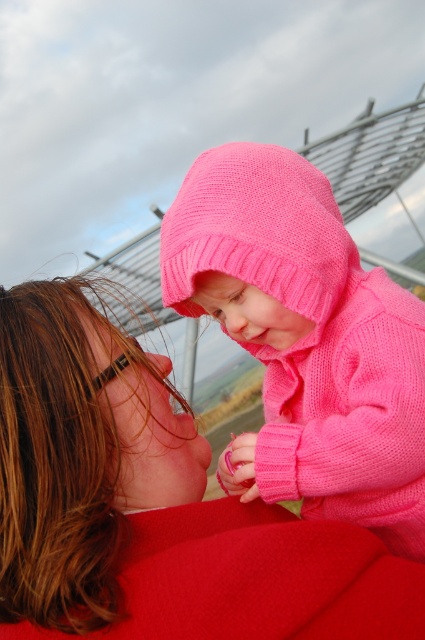
Question: Which point appears farthest from the camera in this image?

Choices:
 (A) (265, 145)
 (B) (59, 493)

Answer: (A)

Question: From the image, what is the correct spatial relationship of matte pink sweater at upper center in relation to knitted pink sweater at center?

Choices:
 (A) below
 (B) above

Answer: (A)

Question: Does matte pink sweater at upper center have a smaller size compared to knitted pink sweater at center?

Choices:
 (A) yes
 (B) no

Answer: (A)

Question: Can you confirm if matte pink sweater at upper center is positioned below knitted pink sweater at center?

Choices:
 (A) yes
 (B) no

Answer: (A)